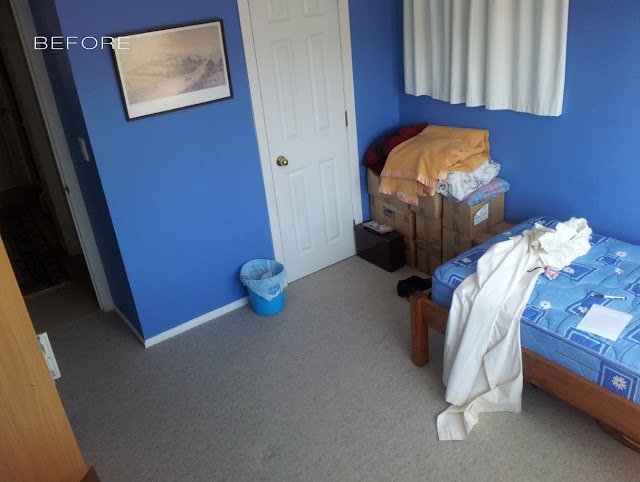
The height and width of the screenshot is (482, 640). Find the location of `white curtains`. white curtains is located at coordinates (520, 77).